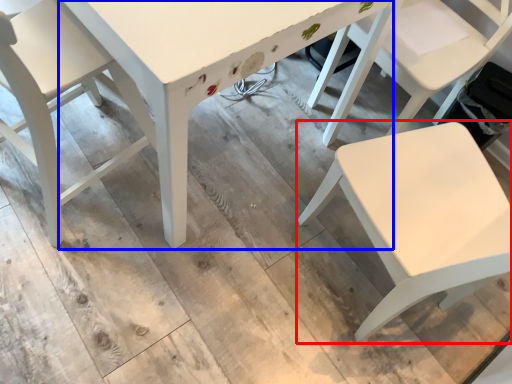
Question: Which object is further to the camera taking this photo, chair (highlighted by a red box) or table (highlighted by a blue box)?

Choices:
 (A) chair
 (B) table

Answer: (B)